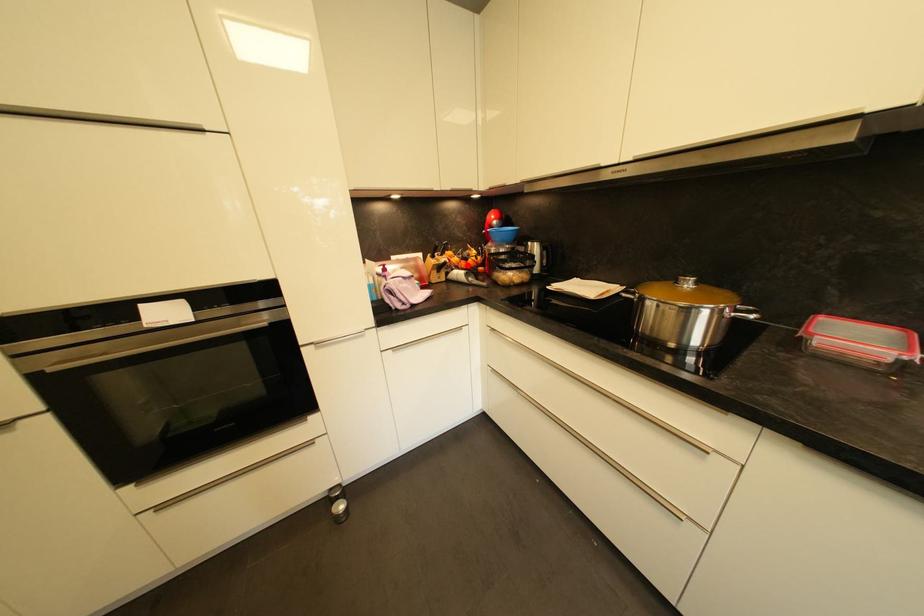
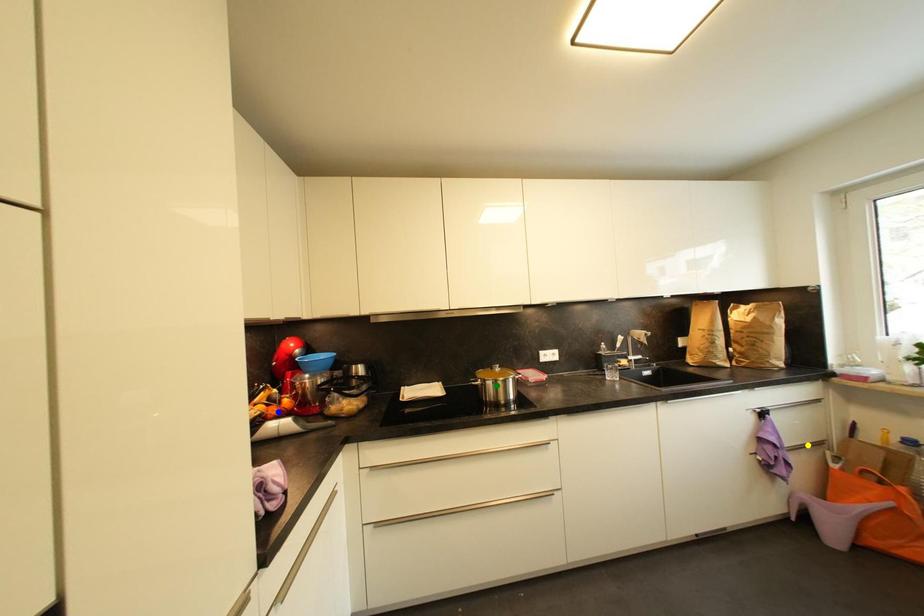
Question: I am providing you with two images of the same scene from different viewpoints. A red point is marked on the first image. You are given multiple points on the second image. Which point in image 2 is actually the same real-world point as the red point in image 1?

Choices:
 (A) yellow point
 (B) green point
 (C) blue point

Answer: (C)